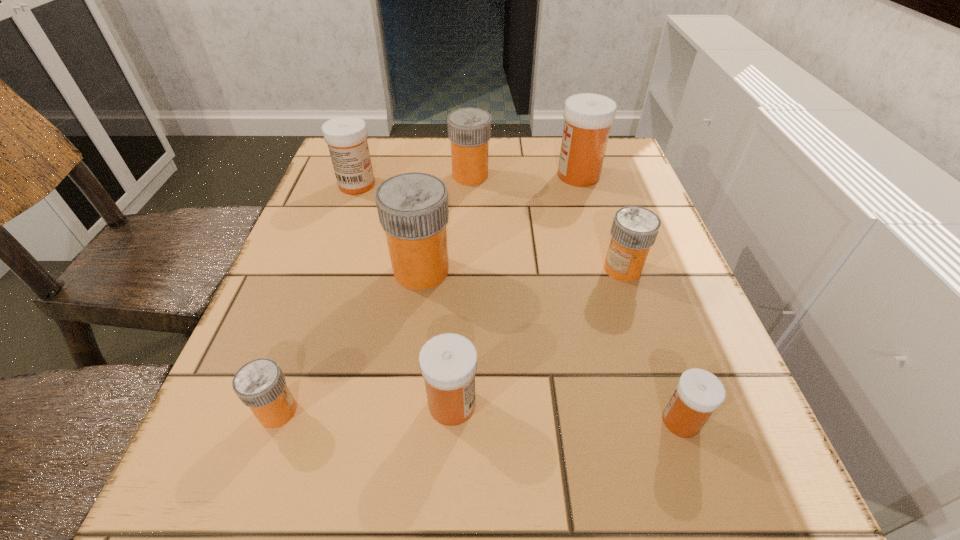
Where is `vacant region between the smallest white medicine and the second smallest orange medicine`? This screenshot has height=540, width=960. vacant region between the smallest white medicine and the second smallest orange medicine is located at coordinates (652, 345).

Identify the location of free space that is in between the second biggest orange medicine and the smallest orange medicine. The width and height of the screenshot is (960, 540). (374, 293).

Locate an element on the screen. This screenshot has width=960, height=540. vacant space that's between the leftmost white medicine and the smallest white medicine is located at coordinates (519, 302).

You are a GUI agent. You are given a task and a screenshot of the screen. Output one action in this format:
    pyautogui.click(x=<x>, y=<y>)
    Task: Click on the vacant space that is in between the biggest white medicine and the biggest orange medicine
    
    Given the screenshot: What is the action you would take?
    pyautogui.click(x=500, y=223)

You are a GUI agent. You are given a task and a screenshot of the screen. Output one action in this format:
    pyautogui.click(x=<x>, y=<y>)
    Task: Click on the vacant area that lies between the smallest white medicine and the biggest white medicine
    
    Given the screenshot: What is the action you would take?
    pyautogui.click(x=630, y=298)

I want to click on vacant area that lies between the smallest orange medicine and the second biggest white medicine, so click(317, 298).

Where is `blank region between the second white medicine from left to right and the biggest white medicine`? This screenshot has width=960, height=540. blank region between the second white medicine from left to right and the biggest white medicine is located at coordinates (516, 289).

Identify which object is located as the second nearest to the biggest orange medicine. Please provide its 2D coordinates. Your answer should be formatted as a tuple, i.e. [(x, y)], where the tuple contains the x and y coordinates of a point satisfying the conditions above.

[(346, 136)]

Point out which object is positioned as the second nearest to the second biggest orange medicine. Please provide its 2D coordinates. Your answer should be formatted as a tuple, i.e. [(x, y)], where the tuple contains the x and y coordinates of a point satisfying the conditions above.

[(346, 136)]

This screenshot has width=960, height=540. In order to click on medicine object that ranks as the second closest to the leftmost orange medicine in this screenshot , I will do `click(413, 211)`.